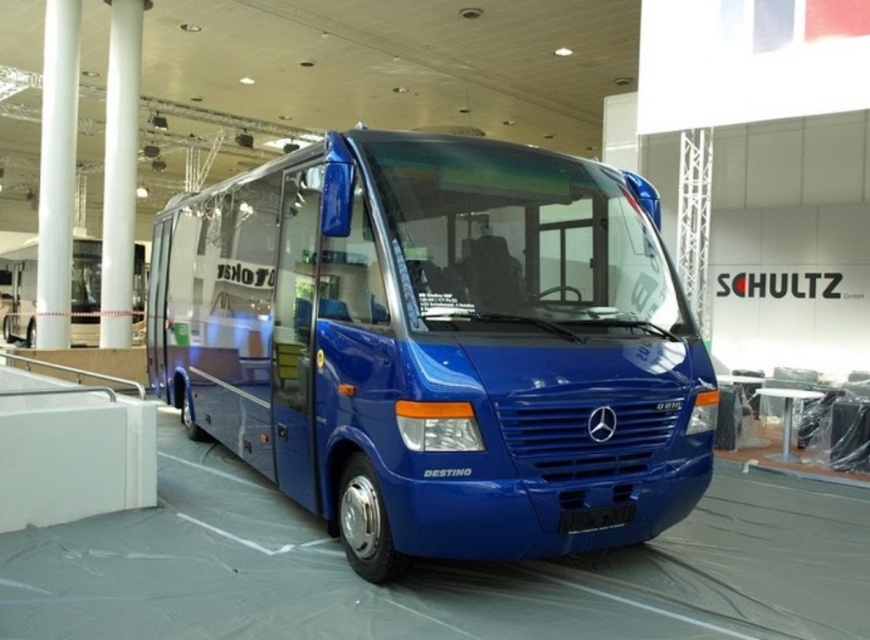
Is glossy blue bus at center smaller than white glossy pillar at left?

Yes, glossy blue bus at center is smaller than white glossy pillar at left.

Which is behind, point (169, 369) or point (65, 93)?

Point (65, 93)

Does point (505, 257) lie behind point (52, 188)?

No, it is not.

Locate an element on the screen. This screenshot has height=640, width=870. glossy blue bus at center is located at coordinates (438, 346).

Does white glossy pillar at left have a lesser height compared to white glossy pillar at center?

Incorrect, white glossy pillar at left's height does not fall short of white glossy pillar at center's.

In the scene shown: Who is more distant from viewer, (39, 177) or (111, 211)?

The point (39, 177) is behind.

What do you see at coordinates (57, 172) in the screenshot?
I see `white glossy pillar at left` at bounding box center [57, 172].

Where is `white glossy pillar at left`? white glossy pillar at left is located at coordinates (57, 172).

Who is positioned more to the left, glossy blue bus at center or white glossy pillar at center?

white glossy pillar at center is more to the left.

Is glossy blue bus at center positioned behind white glossy pillar at center?

No.

Where is `glossy blue bus at center`? This screenshot has height=640, width=870. glossy blue bus at center is located at coordinates (438, 346).

You are a GUI agent. You are given a task and a screenshot of the screen. Output one action in this format:
    pyautogui.click(x=<x>, y=<y>)
    Task: Click on the glossy blue bus at center
    The image size is (870, 640).
    Given the screenshot: What is the action you would take?
    pyautogui.click(x=438, y=346)